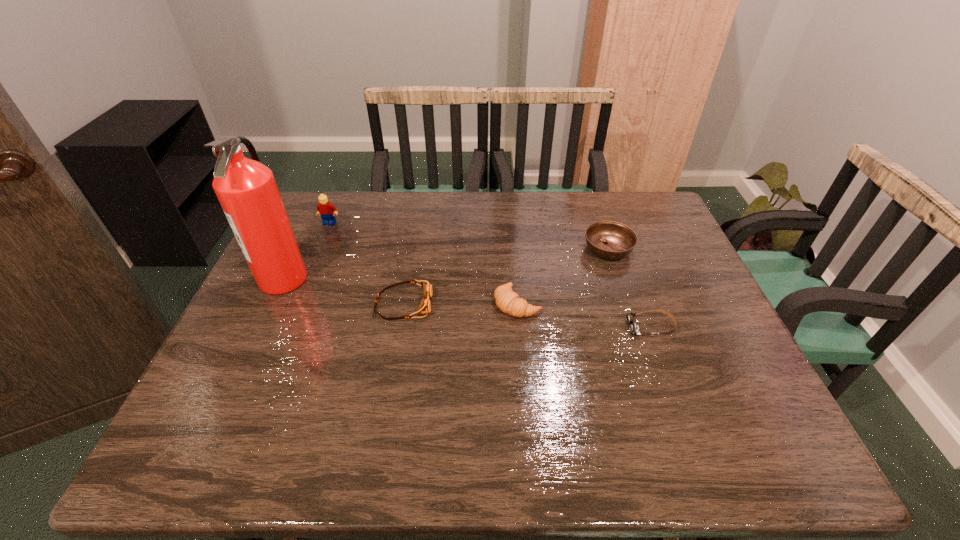
Find the location of a particular element. This screenshot has height=540, width=960. the tallest object is located at coordinates (246, 189).

Locate an element on the screen. This screenshot has width=960, height=540. the fifth shortest object is located at coordinates (325, 208).

At what (x,y) coordinates should I click in order to perform the action: click on Lego. Please return your answer as a coordinate pair (x, y). Looking at the image, I should click on (325, 208).

Locate an element on the screen. This screenshot has height=540, width=960. crescent roll is located at coordinates (509, 302).

At what (x,y) coordinates should I click in order to perform the action: click on soup bowl. Please return your answer as a coordinate pair (x, y). The image size is (960, 540). Looking at the image, I should click on [612, 240].

What are the coordinates of `the left goggles` in the screenshot? It's located at (424, 308).

Where is `the third object from left to right`? the third object from left to right is located at coordinates (424, 308).

The height and width of the screenshot is (540, 960). I want to click on the shortest object, so click(634, 329).

This screenshot has width=960, height=540. In order to click on the right goggles in this screenshot , I will do `click(634, 329)`.

Find the location of a particular element. This screenshot has width=960, height=540. vacant space located at the nozzle of the tallest object is located at coordinates tap(432, 278).